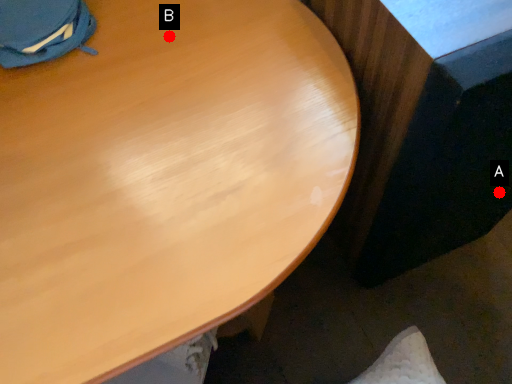
Question: Two points are circled on the image, labeled by A and B beside each circle. Which point is closer to the camera taking this photo?

Choices:
 (A) A is closer
 (B) B is closer

Answer: (B)